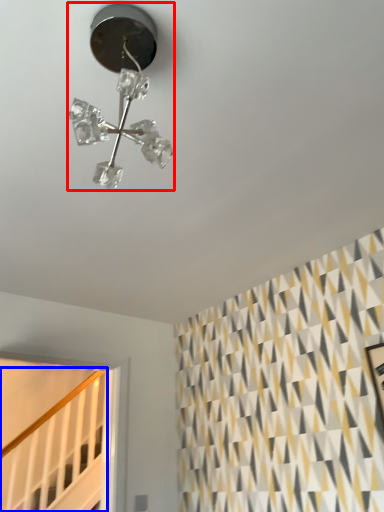
Question: Among these objects, which one is farthest to the camera, lamp (highlighted by a red box) or stairwell (highlighted by a blue box)?

Choices:
 (A) lamp
 (B) stairwell

Answer: (B)